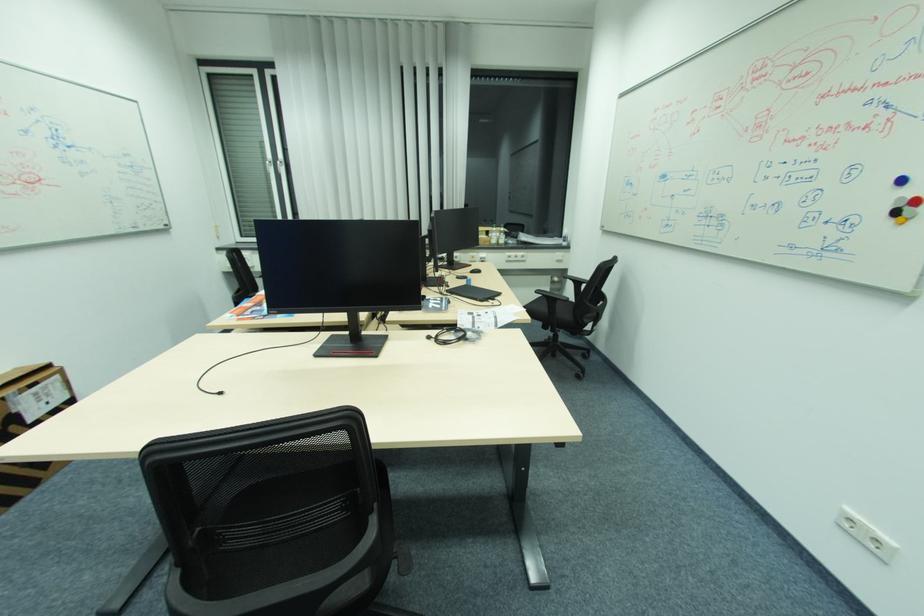
The image size is (924, 616). Identify the location of black cable. (251, 358).